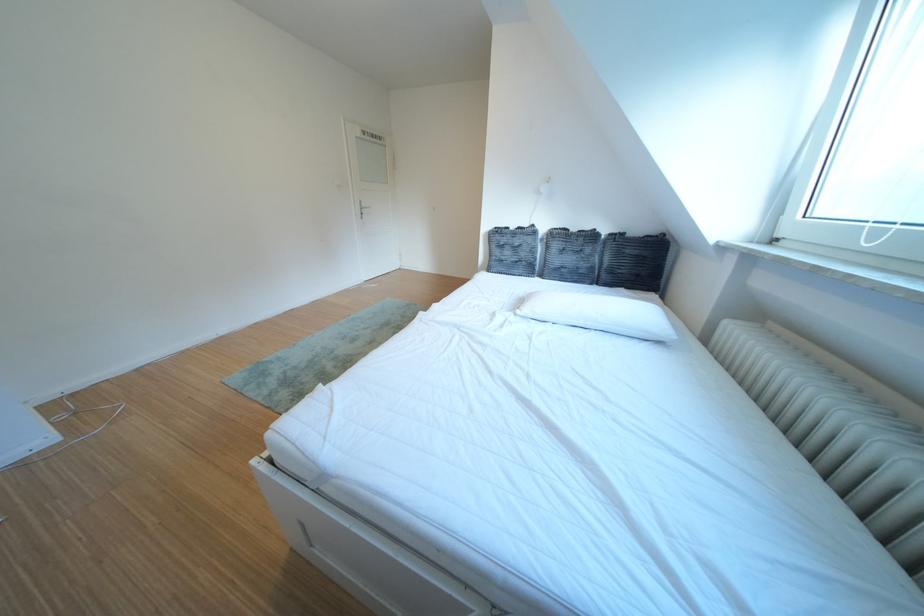
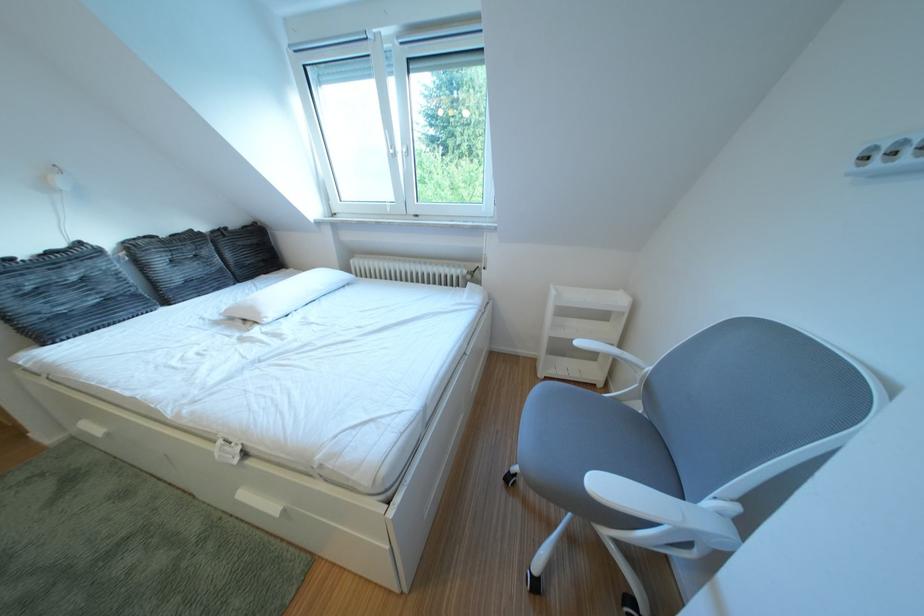
The point at (588, 235) is marked in the first image. Where is the corresponding point in the second image?

(176, 240)